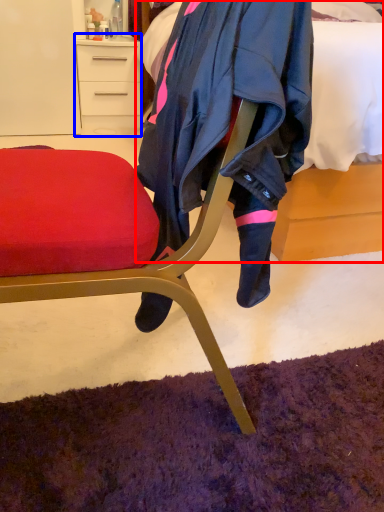
Question: Among these objects, which one is farthest to the camera, bed (highlighted by a red box) or desk (highlighted by a blue box)?

Choices:
 (A) bed
 (B) desk

Answer: (B)